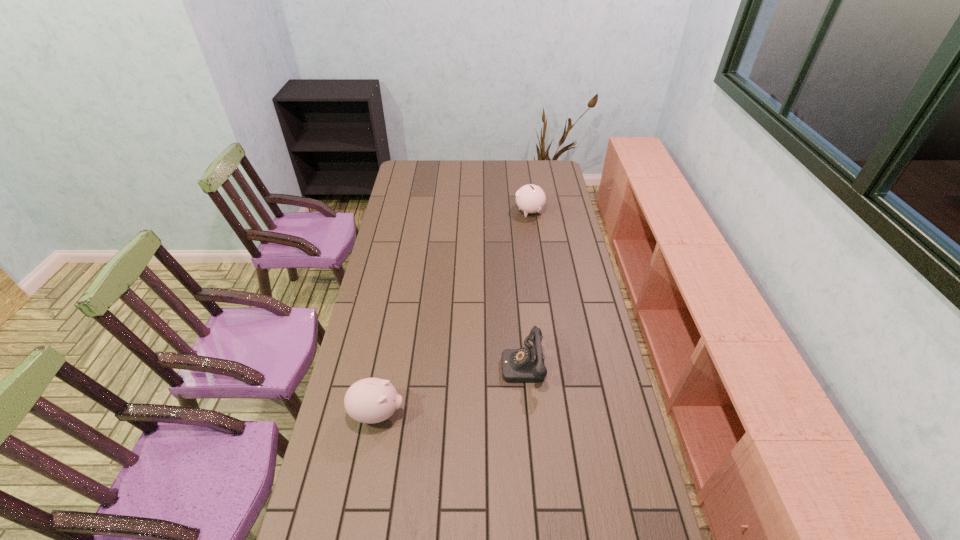
Find the location of a particular element. The height and width of the screenshot is (540, 960). vacant area that lies between the right piggy bank and the nearest object is located at coordinates (453, 313).

The width and height of the screenshot is (960, 540). I want to click on free space between the left piggy bank and the second farthest object, so click(450, 389).

Where is `free space between the second farthest object and the nearest object`? This screenshot has height=540, width=960. free space between the second farthest object and the nearest object is located at coordinates (450, 389).

This screenshot has width=960, height=540. What are the coordinates of `free point between the right piggy bank and the second nearest object` in the screenshot? It's located at (526, 288).

At what (x,y) coordinates should I click in order to perform the action: click on free space between the farther piggy bank and the second farthest object. Please return your answer as a coordinate pair (x, y). The height and width of the screenshot is (540, 960). Looking at the image, I should click on (526, 288).

Where is `unoccupied area between the telephone and the farther piggy bank`? This screenshot has height=540, width=960. unoccupied area between the telephone and the farther piggy bank is located at coordinates (526, 288).

Where is `object that can be found as the closest to the second nearest object`? The width and height of the screenshot is (960, 540). object that can be found as the closest to the second nearest object is located at coordinates (371, 400).

Identify which object is the second nearest to the farthest object. Please provide its 2D coordinates. Your answer should be formatted as a tuple, i.e. [(x, y)], where the tuple contains the x and y coordinates of a point satisfying the conditions above.

[(371, 400)]

This screenshot has height=540, width=960. Find the location of `free space that satisfies the following two spatial constraints: 1. on the front side of the farthest object; 2. at the snout of the leftmost object`. free space that satisfies the following two spatial constraints: 1. on the front side of the farthest object; 2. at the snout of the leftmost object is located at coordinates (558, 413).

At what (x,y) coordinates should I click in order to perform the action: click on vacant space that satisfies the following two spatial constraints: 1. on the front side of the farthest object; 2. at the snout of the leftmost object. Please return your answer as a coordinate pair (x, y). The width and height of the screenshot is (960, 540). Looking at the image, I should click on (558, 413).